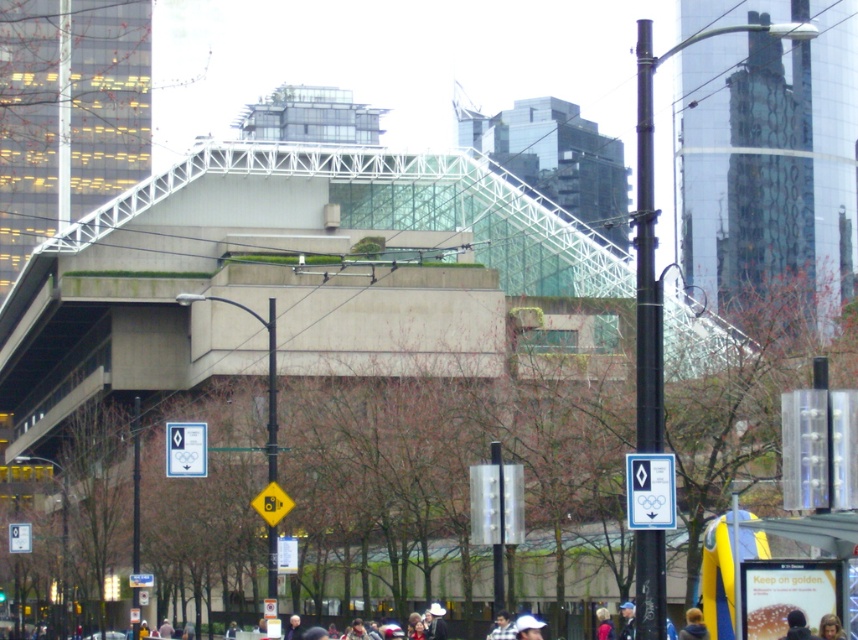
You are a photographer standing at the edge of the busy street. You want to take a photo of both the blue denim jacket at lower right and the dark blue shirt at lower center. Which of the two items should you focus on first if you want to ensure both are in the frame?

The blue denim jacket at lower right is not as tall as the dark blue shirt at lower center, so you should focus on the dark blue shirt at lower center first to ensure both are in the frame.

You are a fashion designer observing pedestrians in the city scene. You notice a blue denim jacket at lower right and a dark blue shirt at lower center. Which clothing item is wider?

The blue denim jacket at lower right is wider than the dark blue shirt at lower center.